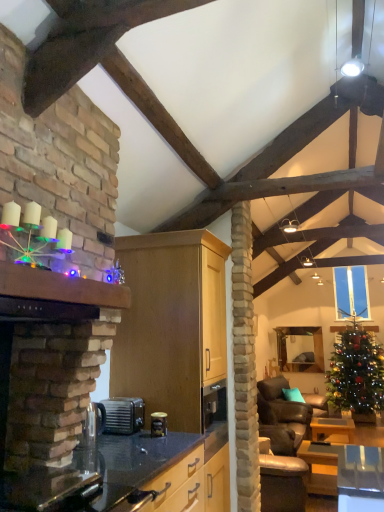
Locate an element on the screen. The height and width of the screenshot is (512, 384). blank space to the left of metallic canister at center, which is the 1th appliance in right-to-left order is located at coordinates (132, 437).